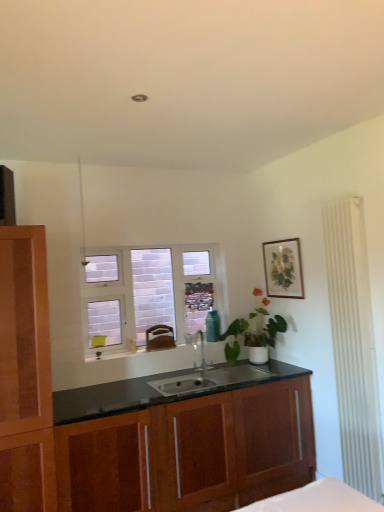
Locate an element on the screen. The width and height of the screenshot is (384, 512). free space to the back side of satin nickel faucet at center is located at coordinates (198, 372).